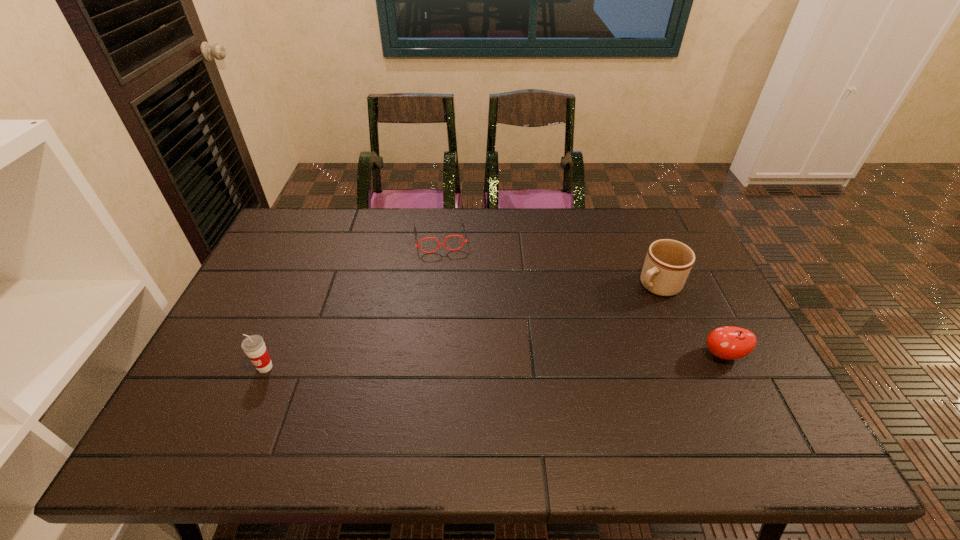
The width and height of the screenshot is (960, 540). Identify the location of vacant space that's between the leftmost object and the apple. [494, 361].

The image size is (960, 540). Identify the location of free spot between the mug and the apple. (690, 320).

Identify which object is located as the nearest to the second farthest object. Please provide its 2D coordinates. Your answer should be formatted as a tuple, i.e. [(x, y)], where the tuple contains the x and y coordinates of a point satisfying the conditions above.

[(729, 342)]

Where is `object that is the third closest to the second farthest object`? The height and width of the screenshot is (540, 960). object that is the third closest to the second farthest object is located at coordinates (254, 347).

This screenshot has height=540, width=960. What are the coordinates of `vacant space that satisfies the following two spatial constraints: 1. on the front side of the apple; 2. on the right side of the mug` in the screenshot? It's located at (686, 355).